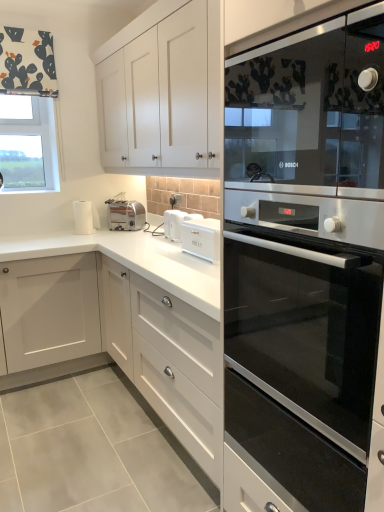
Question: Is stainless steel oven at right in front of or behind black glass oven at right in the image?

Choices:
 (A) front
 (B) behind

Answer: (B)

Question: Considering the relative positions of stainless steel oven at right and black glass oven at right in the image provided, is stainless steel oven at right to the left or to the right of black glass oven at right?

Choices:
 (A) left
 (B) right

Answer: (A)

Question: Estimate the real-world distances between objects in this image. Which object is farther from the white plastic toaster at center, the first appliance from the front?

Choices:
 (A) black glass oven at right
 (B) satin silver toaster at center, which is the second appliance in front-to-back order
 (C) clear glass window at upper left
 (D) stainless steel oven at right
 (E) white glossy cabinet at lower right

Answer: (A)

Question: Which is nearer to the white glossy cabinet at lower right?

Choices:
 (A) clear glass window at upper left
 (B) stainless steel oven at right
 (C) black glass oven at right
 (D) black glass microwave at upper right
 (E) satin silver toaster at center, arranged as the first appliance when viewed from the left

Answer: (B)